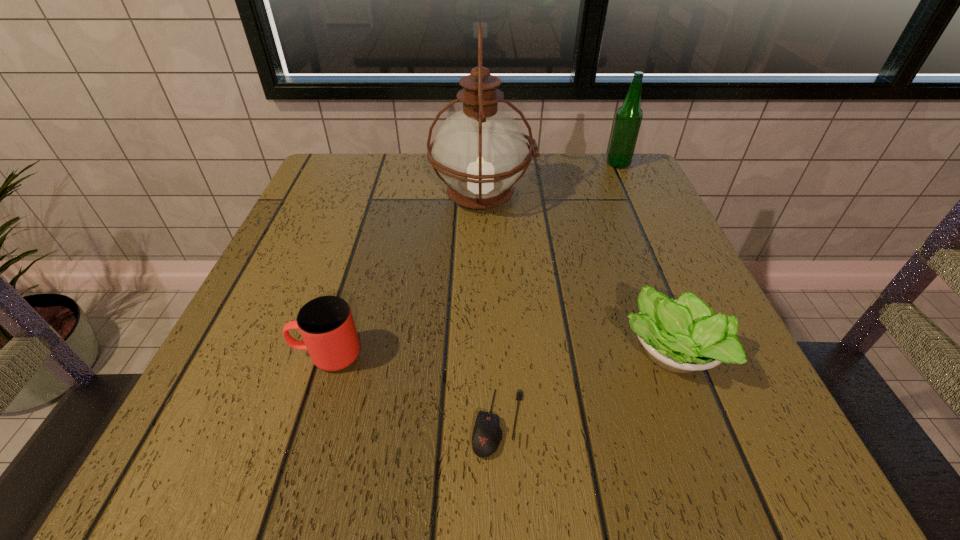
Identify which object is the third closest to the oil lamp. Please provide its 2D coordinates. Your answer should be formatted as a tuple, i.e. [(x, y)], where the tuple contains the x and y coordinates of a point satisfying the conditions above.

[(326, 324)]

This screenshot has width=960, height=540. What are the coordinates of `vacant area that satisfies the following two spatial constraints: 1. on the handle side of the lettuce; 2. on the left side of the leftmost object` in the screenshot? It's located at (327, 352).

Identify the location of vacant area in the image that satisfies the following two spatial constraints: 1. on the front side of the lettuce; 2. on the right side of the oil lamp. The image size is (960, 540). (484, 352).

At what (x,y) coordinates should I click in order to perform the action: click on free point that satisfies the following two spatial constraints: 1. on the label of the beer bottle; 2. on the front side of the fourth nearest object. Please return your answer as a coordinate pair (x, y). This screenshot has height=540, width=960. Looking at the image, I should click on (634, 197).

Identify the location of free space that satisfies the following two spatial constraints: 1. on the label of the farthest object; 2. on the front side of the fourth tallest object. This screenshot has width=960, height=540. (706, 352).

Find the location of a particular element. The image size is (960, 540). vacant space that satisfies the following two spatial constraints: 1. on the handle side of the cup; 2. on the right side of the lettuce is located at coordinates (327, 352).